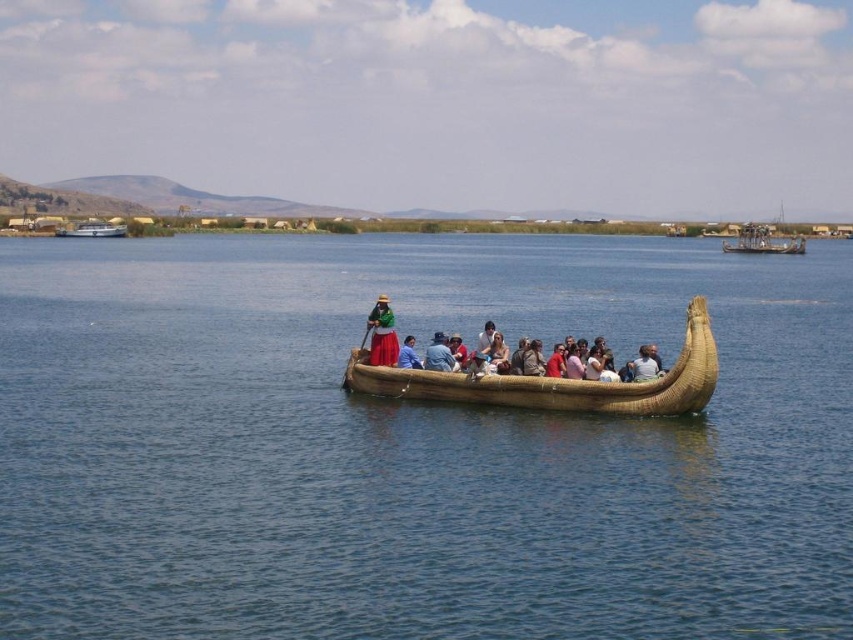
You are a tourist planning to take a boat ride on Lake Titicaca. You see both the metallic silver boat at upper right and the light brown woven reed boat at center. Which boat is bigger?

The metallic silver boat at upper right is larger in size compared to the light brown woven reed boat at center.

You are standing on the shore of Lake Titicaca and see the Uros boat with two points marked. The first point is at coordinates point (x=645, y=387) and the second point is at point (x=65, y=236). Which point is closer to you?

Point (x=645, y=387) is closer to the camera than point (x=65, y=236), so the first point is closer to you.